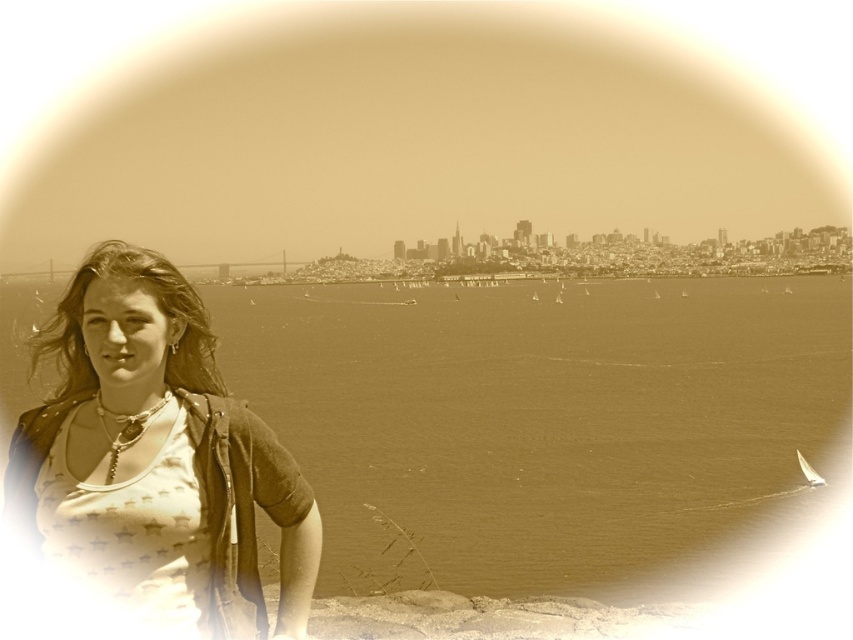
Can you confirm if brown water at center is positioned to the left of metallic bridge at center?

Incorrect, brown water at center is not on the left side of metallic bridge at center.

At what (x,y) coordinates should I click in order to perform the action: click on brown water at center. Please return your answer as a coordinate pair (x, y). The width and height of the screenshot is (853, 640). Looking at the image, I should click on (541, 420).

Where is `brown water at center`? The height and width of the screenshot is (640, 853). brown water at center is located at coordinates (541, 420).

Between brown water at center and white sailboat at lower right, which one is positioned higher?

Positioned higher is brown water at center.

The width and height of the screenshot is (853, 640). Identify the location of brown water at center. (541, 420).

Which of these two, metallic bridge at center or white sailboat at lower right, stands shorter?

Standing shorter between the two is metallic bridge at center.

This screenshot has width=853, height=640. In order to click on metallic bridge at center in this screenshot , I will do (241, 268).

What do you see at coordinates (241, 268) in the screenshot? The height and width of the screenshot is (640, 853). I see `metallic bridge at center` at bounding box center [241, 268].

The height and width of the screenshot is (640, 853). Find the location of `metallic bridge at center`. metallic bridge at center is located at coordinates (241, 268).